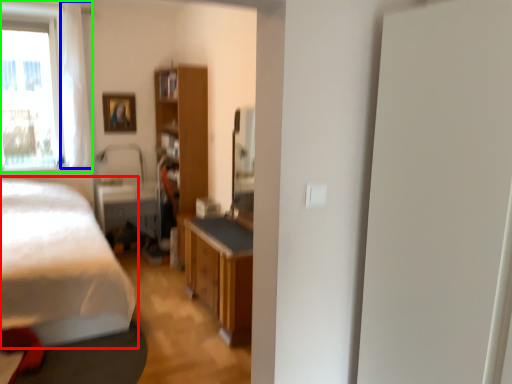
Question: Which is farther away from bed (highlighted by a red box)? curtain (highlighted by a blue box) or window (highlighted by a green box)?

Choices:
 (A) curtain
 (B) window

Answer: (B)